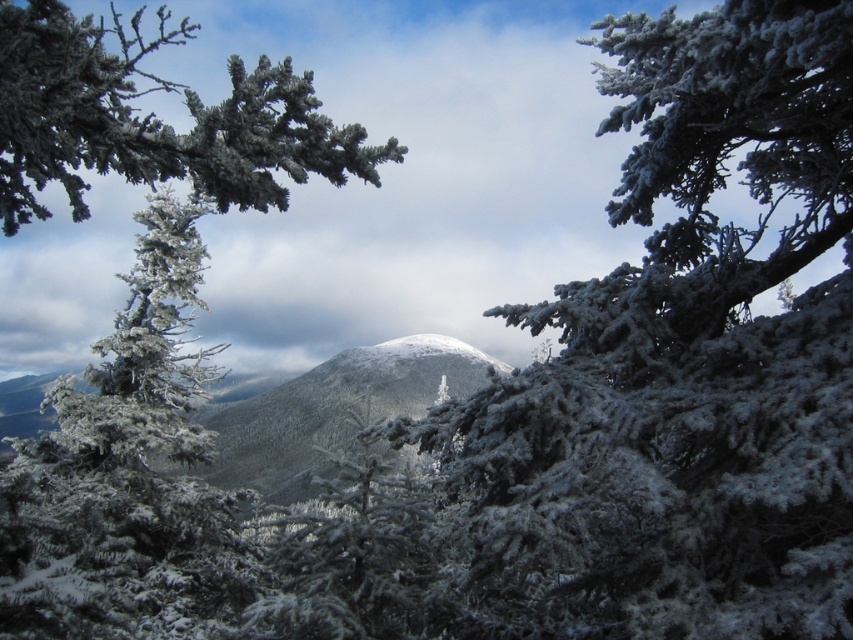
You are an observer standing in the winter landscape. You see the frosted pine tree at center and the white frosty mountain at center. Which object is nearer to you?

The frosted pine tree at center is closer to the viewer than the white frosty mountain at center.

You are standing in the winter landscape scene and want to take a photo of the frosted pine tree at center. The camera you are using has a fixed focus point at coordinate point (126, 474). Will the frosted pine tree at center be in focus when you take the photo?

Yes, the frosted pine tree at center is located exactly at point (126, 474), so it will be in focus when you take the photo with the camera set to that focus point.